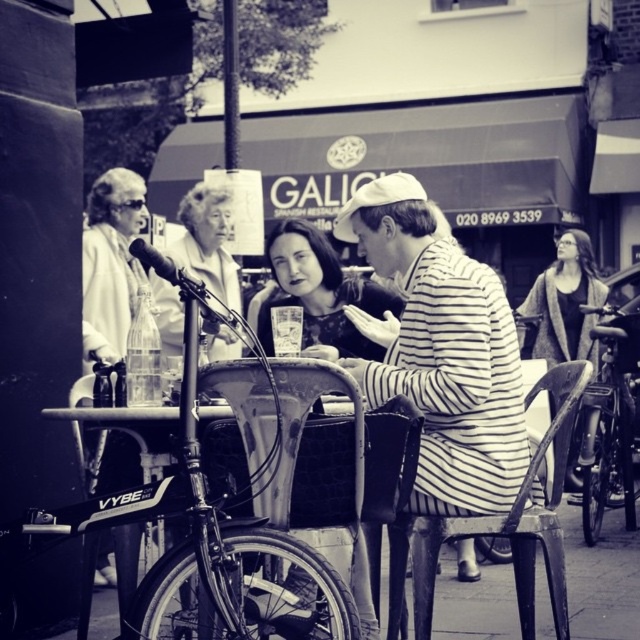
You are a delivery person who needs to park your shiny metallic bicycle at right near the GALICIA building. According to the image, where exactly should you place it?

The shiny metallic bicycle at right should be placed at point (609, 422) as shown in the image.